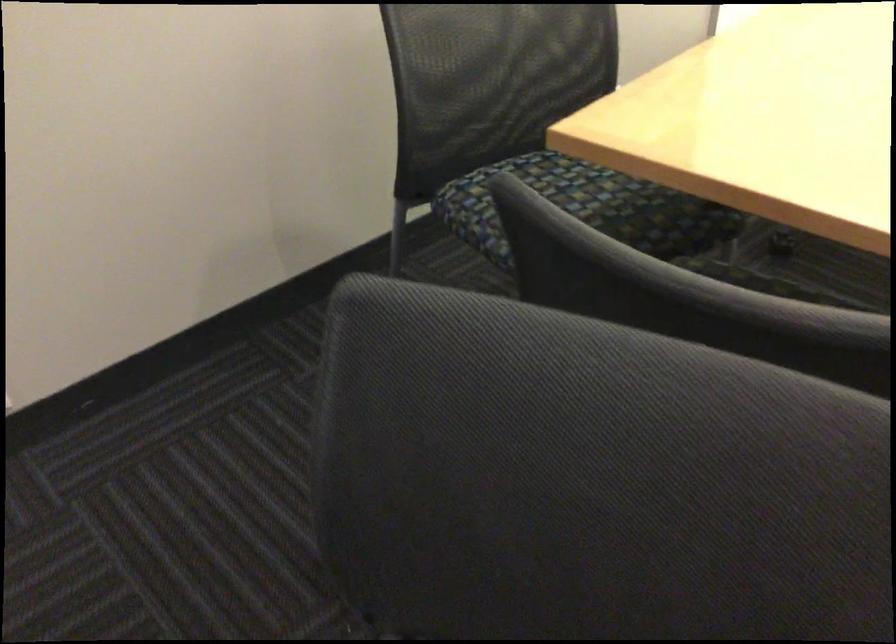
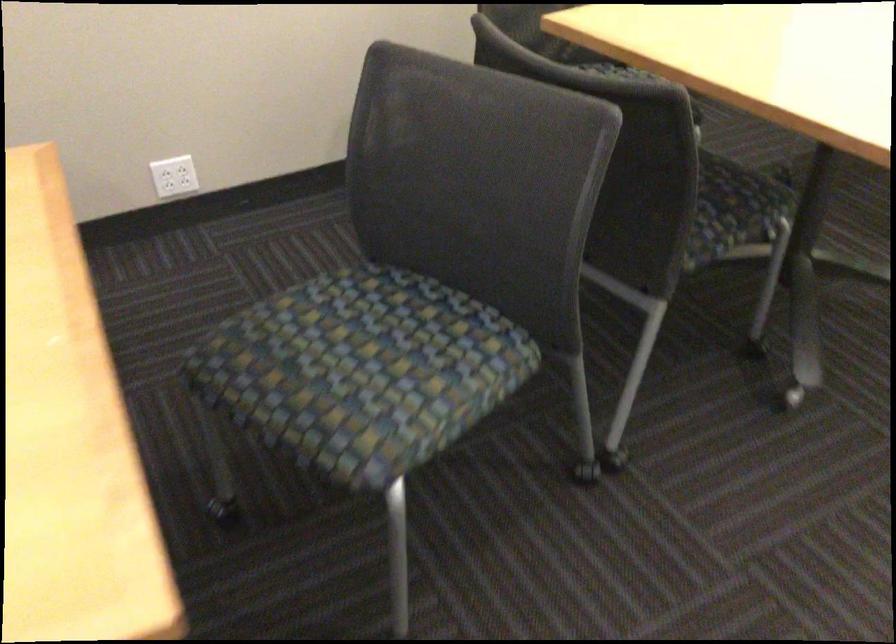
Question: The images are taken continuously from a first-person perspective. In which direction is your viewpoint rotating?

Choices:
 (A) Left
 (B) Right
 (C) Up
 (D) Down

Answer: (A)